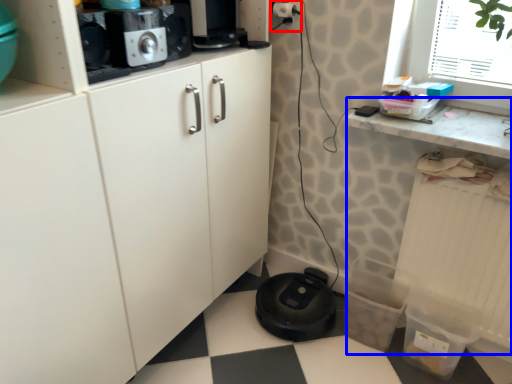
Question: Which object is further to the camera taking this photo, electric outlet (highlighted by a red box) or counter (highlighted by a blue box)?

Choices:
 (A) electric outlet
 (B) counter

Answer: (A)